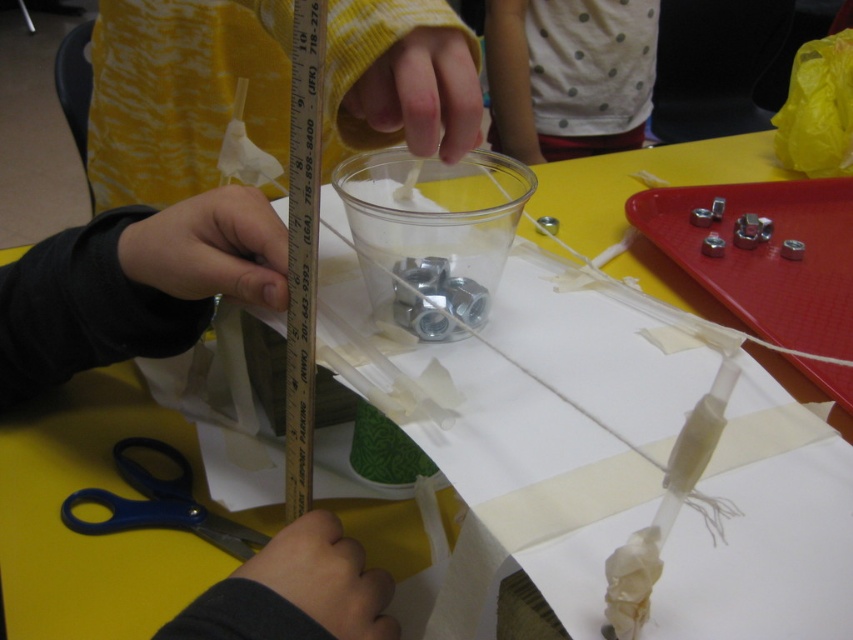
Question: Which point is closer to the camera?

Choices:
 (A) black matte ruler at upper center
 (B) white dotted fabric at upper center
 (C) blue plastic scissors at lower left
 (D) yellow/yellowish fabric at upper center

Answer: (A)

Question: Does black matte ruler at upper center have a larger size compared to yellow/yellowish fabric at upper center?

Choices:
 (A) no
 (B) yes

Answer: (A)

Question: Can you confirm if yellow/yellowish fabric at upper center is thinner than blue plastic scissors at lower left?

Choices:
 (A) yes
 (B) no

Answer: (B)

Question: Which point appears closest to the camera in this image?

Choices:
 (A) (643, 106)
 (B) (322, 547)

Answer: (B)

Question: Can you confirm if black matte ruler at upper center is smaller than yellow/yellowish fabric at upper center?

Choices:
 (A) yes
 (B) no

Answer: (A)

Question: Estimate the real-world distances between objects in this image. Which object is closer to the black matte ruler at upper center?

Choices:
 (A) blue plastic scissors at lower left
 (B) white dotted fabric at upper center
 (C) yellow/yellowish fabric at upper center

Answer: (A)